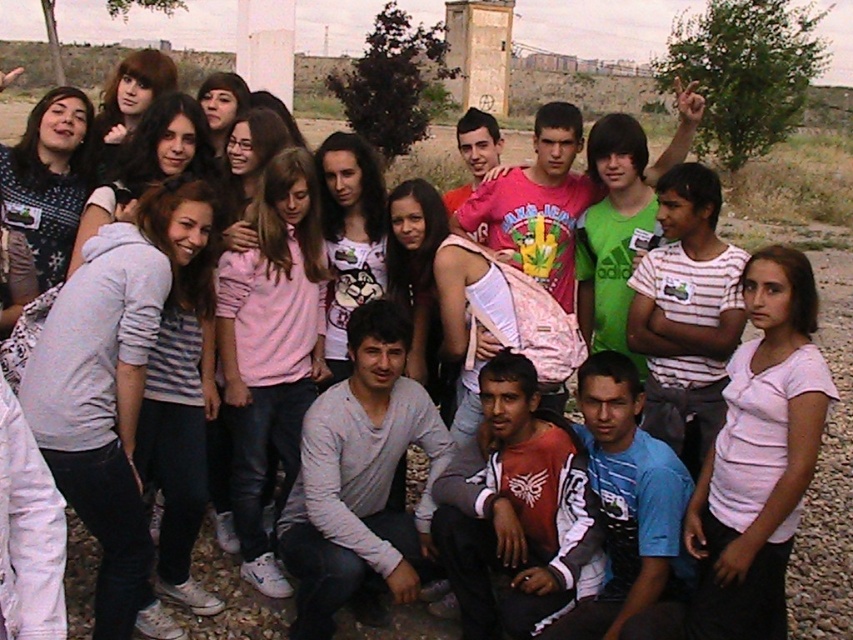
Question: Which of the following is the farthest from the observer?

Choices:
 (A) (114, 596)
 (B) (326, 531)
 (C) (223, 291)

Answer: (C)

Question: Does gray hoodie at left appear on the left side of white striped shirt at center?

Choices:
 (A) yes
 (B) no

Answer: (A)

Question: Is matte red shirt at center closer to the viewer compared to pink fabric shirt at center?

Choices:
 (A) yes
 (B) no

Answer: (A)

Question: Which point is closer to the camera?

Choices:
 (A) gray hoodie at left
 (B) pink fabric shirt at center

Answer: (A)

Question: Which point is farther to the camera?

Choices:
 (A) white striped shirt at center
 (B) blue cotton shirt at center
 (C) matte red shirt at center
 (D) gray hoodie at left

Answer: (A)

Question: Considering the relative positions of pink fabric shirt at center and white striped shirt at center in the image provided, where is pink fabric shirt at center located with respect to white striped shirt at center?

Choices:
 (A) below
 (B) above

Answer: (B)